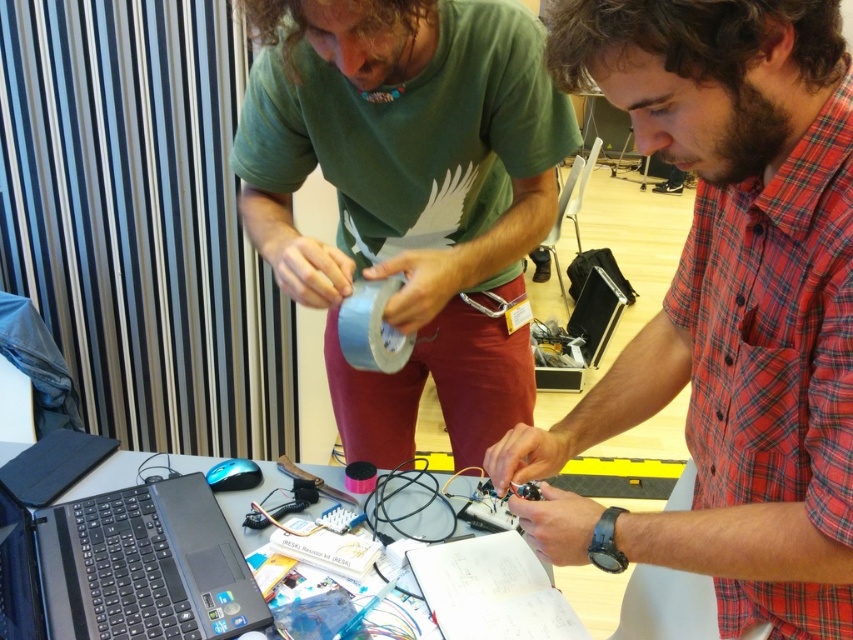
You are standing in front of the table where the two people are working. There are two points marked on the table surface. One is at coordinates point (786,605) and the other at point (154,518). Which point is nearer to you?

Point (786,605) is closer to the viewer than point (154,518).

You are standing in the workshop and need to place a box that requires 1.2 meters of vertical space. Can the red plaid shirt at center and the black plastic laptop at lower left accommodate this requirement?

The red plaid shirt at center is much taller than the black plastic laptop at lower left. However, without specific height measurements for either object, it is impossible to determine if either can accommodate the 1.2 meters of vertical space required for the box.